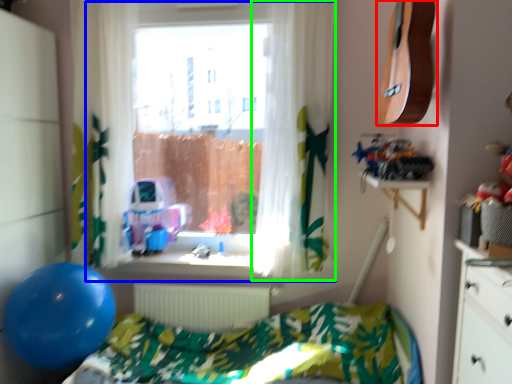
Question: Estimate the real-world distances between objects in this image. Which object is farther from guitar (highlighted by a red box), window (highlighted by a blue box) or curtain (highlighted by a green box)?

Choices:
 (A) window
 (B) curtain

Answer: (A)